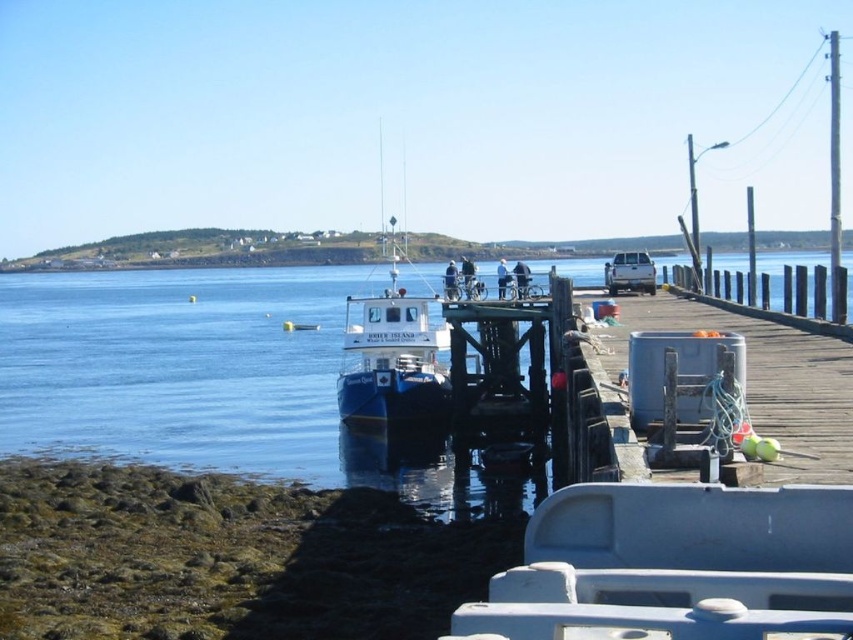
Question: Which point appears farthest from the camera in this image?

Choices:
 (A) (424, 296)
 (B) (688, 314)

Answer: (A)

Question: Which of the following is the farthest from the observer?

Choices:
 (A) blue matte boat at center
 (B) matte white truck at center
 (C) white matte boat at center

Answer: (B)

Question: Is white matte boat at center above matte white truck at center?

Choices:
 (A) yes
 (B) no

Answer: (B)

Question: Is white matte boat at center positioned at the back of matte white truck at center?

Choices:
 (A) no
 (B) yes

Answer: (A)

Question: Among these objects, which one is farthest from the camera?

Choices:
 (A) blue matte boat at center
 (B) matte white truck at center

Answer: (B)

Question: Is white matte boat at center to the left of blue matte boat at center from the viewer's perspective?

Choices:
 (A) yes
 (B) no

Answer: (B)